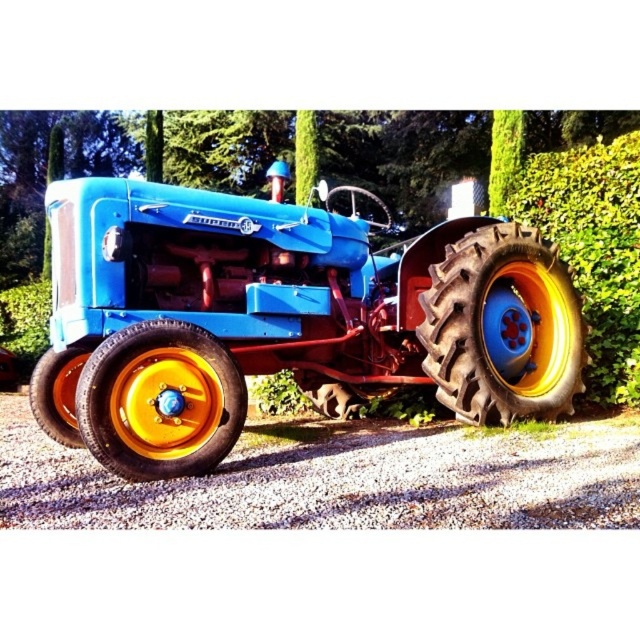
You are standing at the point labeled as point (502, 326) in the image. What object are you currently standing on?

You are standing on the rubber textured tire at center.

You are a gardener who needs to move the matte blue tractor at center to the left to access the green leafy hedge at right for trimming. Is the tractor currently positioned in a way that allows you to move it left without hitting any obstacles?

The matte blue tractor at center is to the left of green leafy hedge at right, so moving it further left would require checking for space. However, since the tractor is already positioned to the left of the hedge, there might be enough space to move it left to access the hedge for trimming.